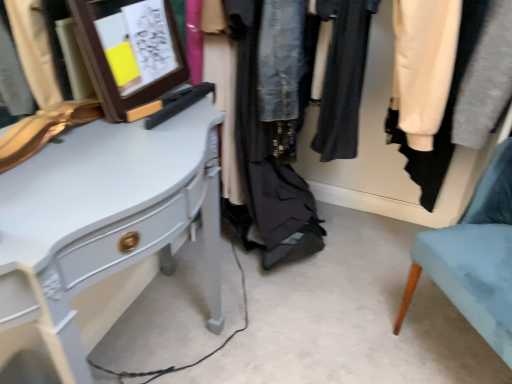
Identify the location of free space to the left of light blue fabric chair at lower right. (334, 328).